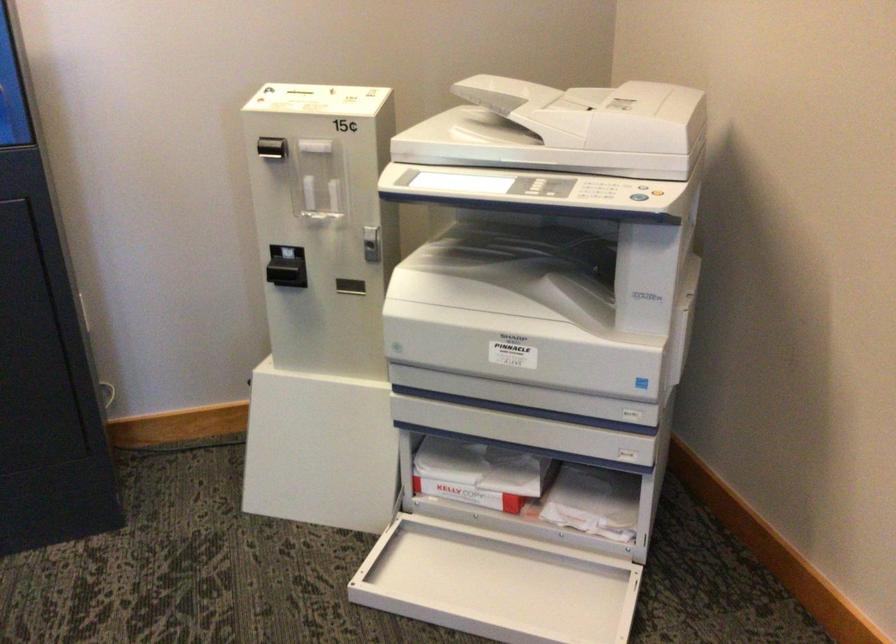
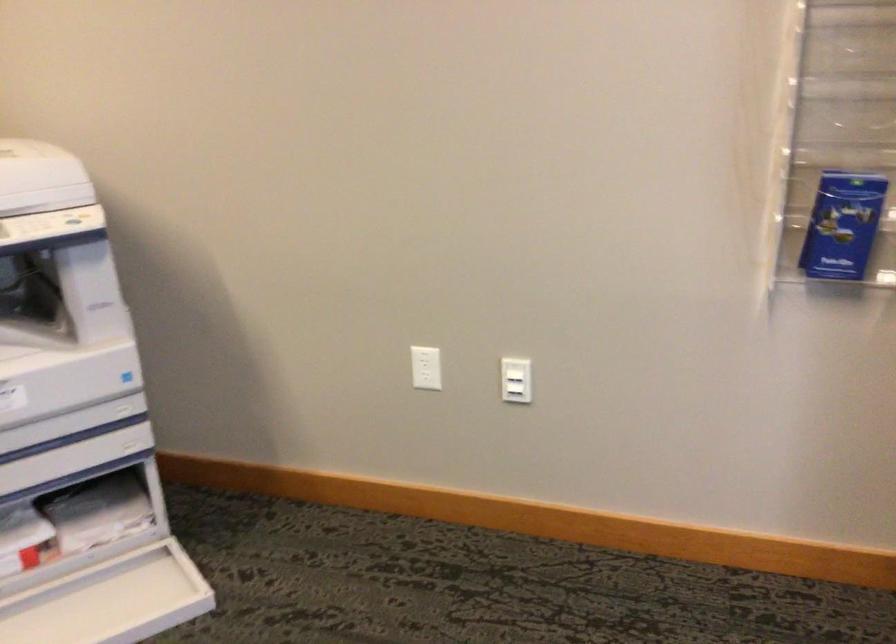
Where in the second image is the point corresponding to (x=574, y=506) from the first image?

(91, 523)